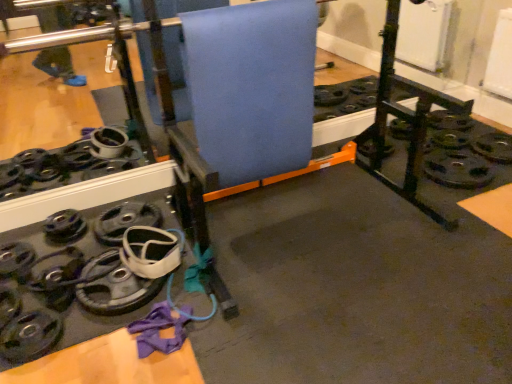
Question: Should I look upward or downward to see blue fabric yoga mat at center?

Choices:
 (A) down
 (B) up

Answer: (B)

Question: Does blue fabric yoga mat at center have a smaller size compared to black rubber weight at lower left?

Choices:
 (A) yes
 (B) no

Answer: (B)

Question: Does blue fabric yoga mat at center lie in front of black rubber weight at lower left?

Choices:
 (A) no
 (B) yes

Answer: (A)

Question: Is blue fabric yoga mat at center thinner than black rubber weight at lower left?

Choices:
 (A) no
 (B) yes

Answer: (B)

Question: Are blue fabric yoga mat at center and black rubber weight at lower left far apart?

Choices:
 (A) no
 (B) yes

Answer: (B)

Question: Considering the relative sizes of blue fabric yoga mat at center and black rubber weight at lower left in the image provided, is blue fabric yoga mat at center taller than black rubber weight at lower left?

Choices:
 (A) no
 (B) yes

Answer: (B)

Question: Does blue fabric yoga mat at center have a lesser height compared to black rubber weight at lower left?

Choices:
 (A) no
 (B) yes

Answer: (A)

Question: Is black rubber weight at lower left to the right of blue fabric yoga mat at center from the viewer's perspective?

Choices:
 (A) no
 (B) yes

Answer: (A)

Question: Considering the relative sizes of black rubber weight at lower left and blue fabric yoga mat at center in the image provided, is black rubber weight at lower left wider than blue fabric yoga mat at center?

Choices:
 (A) yes
 (B) no

Answer: (A)

Question: Does black rubber weight at lower left have a lesser width compared to blue fabric yoga mat at center?

Choices:
 (A) no
 (B) yes

Answer: (A)

Question: Is black rubber weight at lower left behind blue fabric yoga mat at center?

Choices:
 (A) yes
 (B) no

Answer: (B)

Question: Is black rubber weight at lower left facing towards blue fabric yoga mat at center?

Choices:
 (A) yes
 (B) no

Answer: (B)

Question: Is black rubber weight at lower left shorter than blue fabric yoga mat at center?

Choices:
 (A) no
 (B) yes

Answer: (B)

Question: Considering their positions, is blue fabric yoga mat at center located in front of or behind black rubber weight at lower left?

Choices:
 (A) behind
 (B) front

Answer: (A)